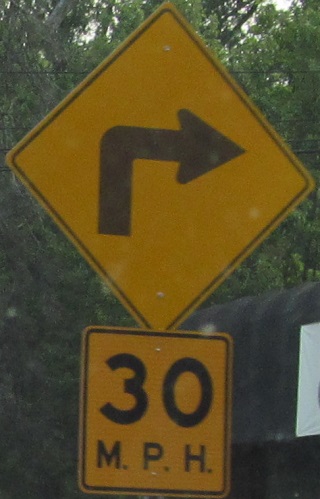
Locate an element on the screen. Image resolution: width=320 pixels, height=499 pixels. electric wiring is located at coordinates (284, 71), (304, 150), (308, 141), (304, 119), (14, 126), (27, 73), (6, 169), (5, 149).